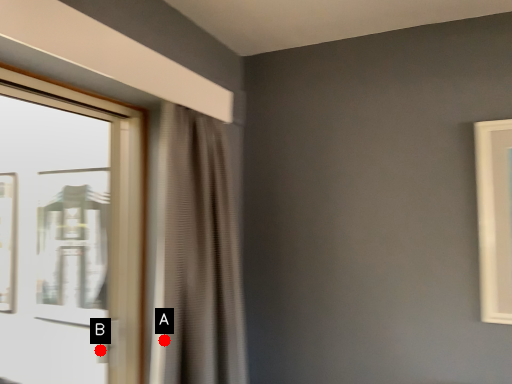
Question: Two points are circled on the image, labeled by A and B beside each circle. Which point appears farthest from the camera in this image?

Choices:
 (A) A is further
 (B) B is further

Answer: (B)